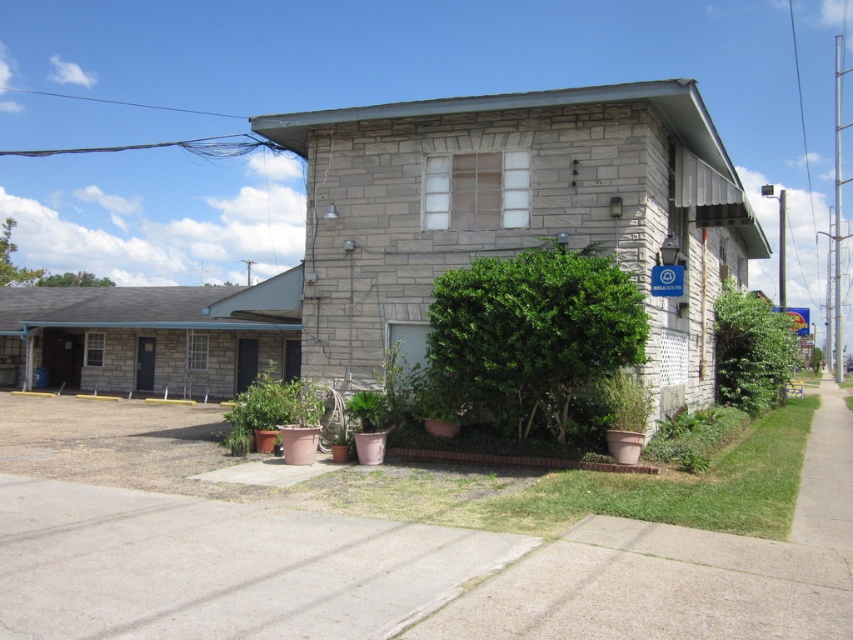
You are standing in front of the building and want to place a small decorative item between the matte terracotta pot at center and the green matte plant at lower center. Based on their positions, which object is nearer to you so you can place the item closer to it?

The matte terracotta pot at center is closer to the viewer than the green matte plant at lower center, so you should place the item closer to the matte terracotta pot at center.

You are a delivery person trying to place a package between the matte terracotta pot at center and the green matte planter at lower right. The package requires 5 meters of space to ensure it doesn t obstruct the pathway. Based on the scene, will there be enough space?

The distance between the matte terracotta pot at center and the green matte planter at lower right is 4.62 meters, which is less than the required 5 meters. Therefore, placing the package there would not provide enough space and might obstruct the pathway.